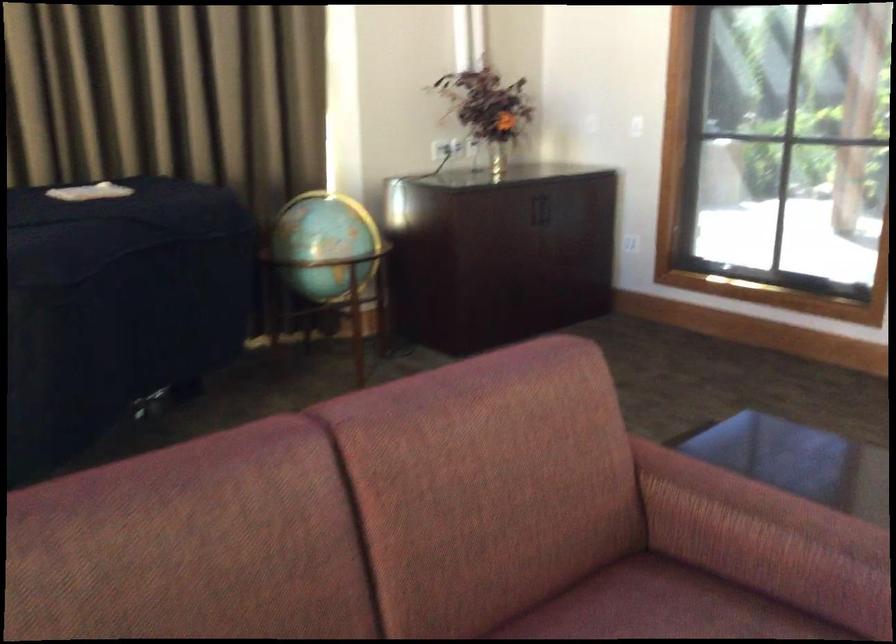
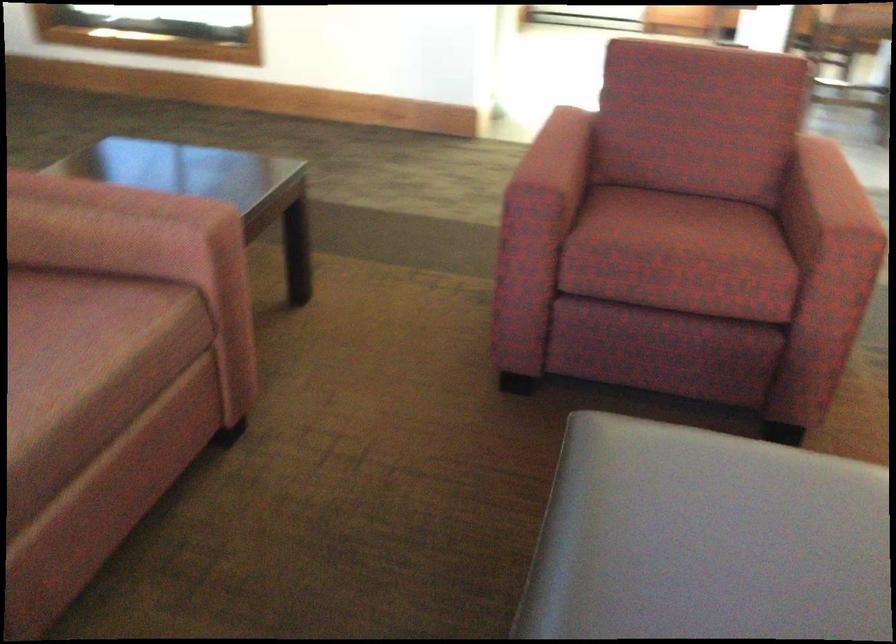
The images are taken continuously from a first-person perspective. In which direction is your viewpoint rotating?

The rotation direction of the camera is right-down.